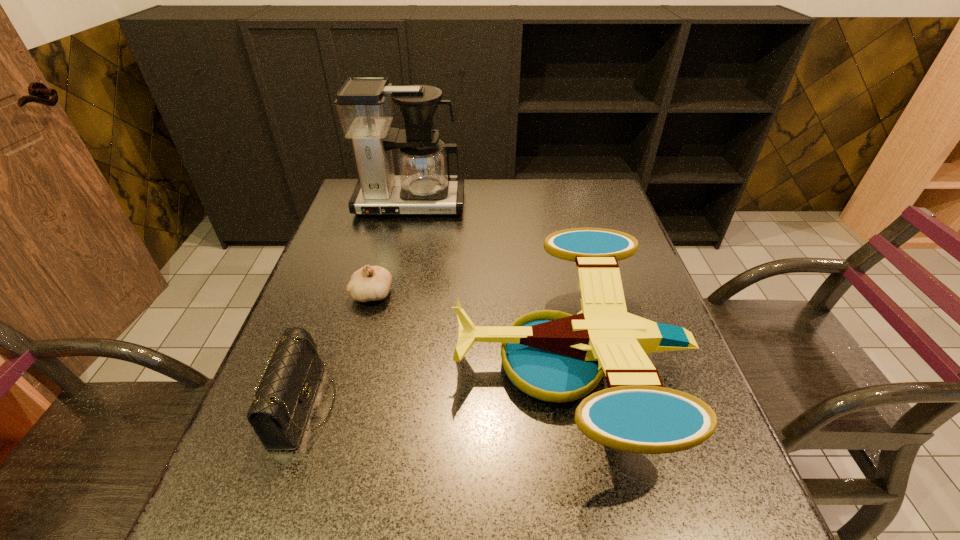
Where is `free location located on the right of the garlic`? free location located on the right of the garlic is located at coordinates (413, 294).

At what (x,y) coordinates should I click in order to perform the action: click on object situated at the far edge. Please return your answer as a coordinate pair (x, y). Looking at the image, I should click on (424, 185).

Where is `coffee maker that is at the left edge`? coffee maker that is at the left edge is located at coordinates (424, 185).

I want to click on clutch bag present at the left edge, so click(285, 392).

Where is `garlic that is at the left edge`? This screenshot has height=540, width=960. garlic that is at the left edge is located at coordinates (370, 283).

This screenshot has width=960, height=540. In order to click on object that is positioned at the right edge in this screenshot , I will do `click(552, 356)`.

Locate an element on the screen. The width and height of the screenshot is (960, 540). object present at the far left corner is located at coordinates (424, 185).

Find the location of a particular element. vacant space at the far edge of the desktop is located at coordinates (551, 210).

In the image, there is a desktop. What are the coordinates of `vacant region at the left edge` in the screenshot? It's located at (244, 495).

At what (x,y) coordinates should I click in order to perform the action: click on vacant position at the right edge of the desktop. Please return your answer as a coordinate pair (x, y). This screenshot has height=540, width=960. Looking at the image, I should click on (723, 487).